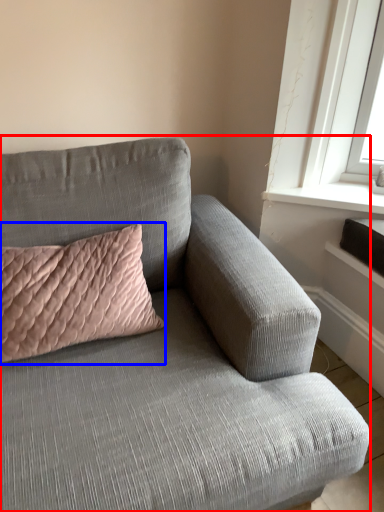
Question: Which point is closer to the camera, studio couch (highlighted by a red box) or pillow (highlighted by a blue box)?

Choices:
 (A) studio couch
 (B) pillow

Answer: (A)